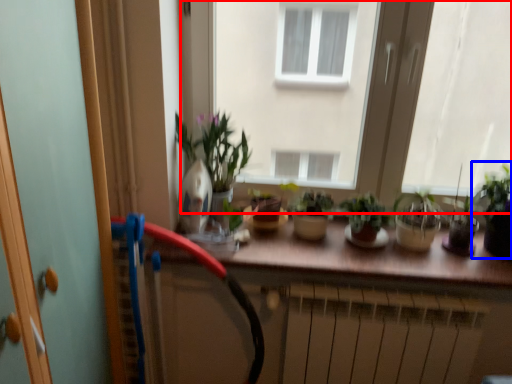
Question: Which of the following is the closest to the observer, window (highlighted by a red box) or houseplant (highlighted by a blue box)?

Choices:
 (A) window
 (B) houseplant

Answer: (B)